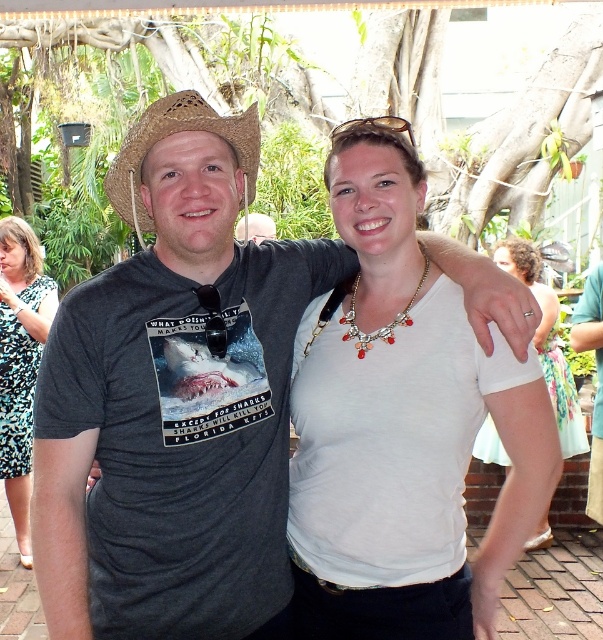
Based on the photo, you are a photographer trying to adjust the focus on your camera. You need to ensure that both the printed fabric dress at left and the white matte tank top at center are in focus. Given their sizes, which one should you prioritize focusing on first to ensure proper depth of field?

The printed fabric dress at left is larger in size compared to the white matte tank top at center, so you should prioritize focusing on the printed fabric dress at left first to ensure proper depth of field.